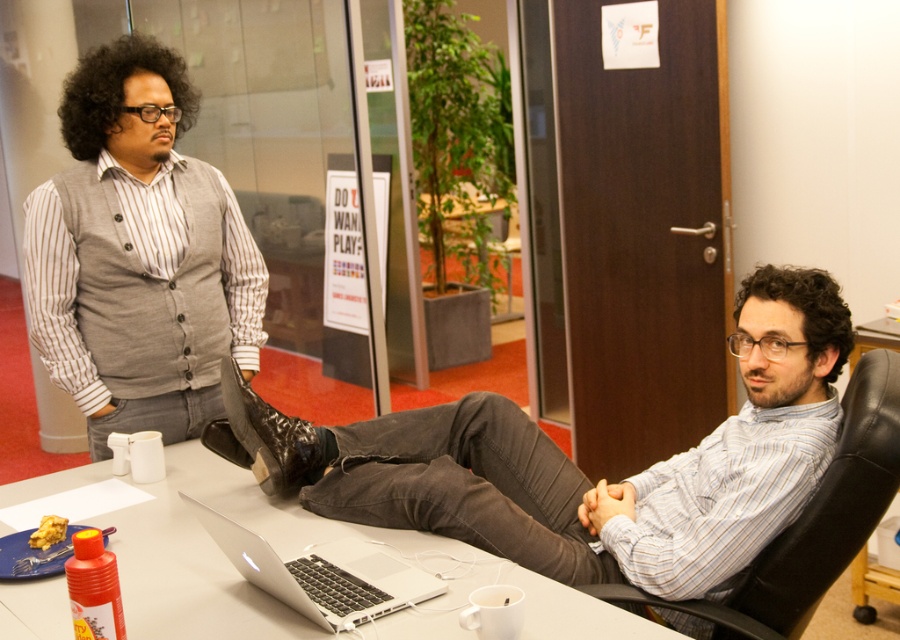
Is matte gray vest at left to the left of silver metallic laptop at center from the viewer's perspective?

Yes, matte gray vest at left is to the left of silver metallic laptop at center.

This screenshot has height=640, width=900. I want to click on matte gray vest at left, so click(140, 253).

Who is positioned more to the right, white glossy table at center or black leather swivel chair at center?

Positioned to the right is black leather swivel chair at center.

This screenshot has height=640, width=900. What are the coordinates of `white glossy table at center` in the screenshot? It's located at (302, 554).

Which of these two, white glossy table at center or shiny black boot at center, stands shorter?

Standing shorter between the two is white glossy table at center.

Is point (34, 582) behind point (266, 440)?

That is False.

Is point (451, 596) behind point (258, 417)?

No, (451, 596) is in front of (258, 417).

Where is `white glossy table at center`? white glossy table at center is located at coordinates (302, 554).